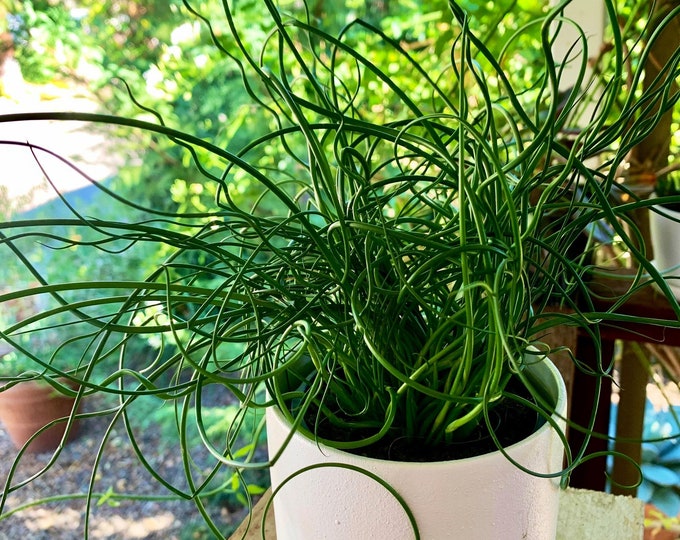
What are the coordinates of `dark colored table` in the screenshot? It's located at (643, 307), (585, 388), (630, 394).